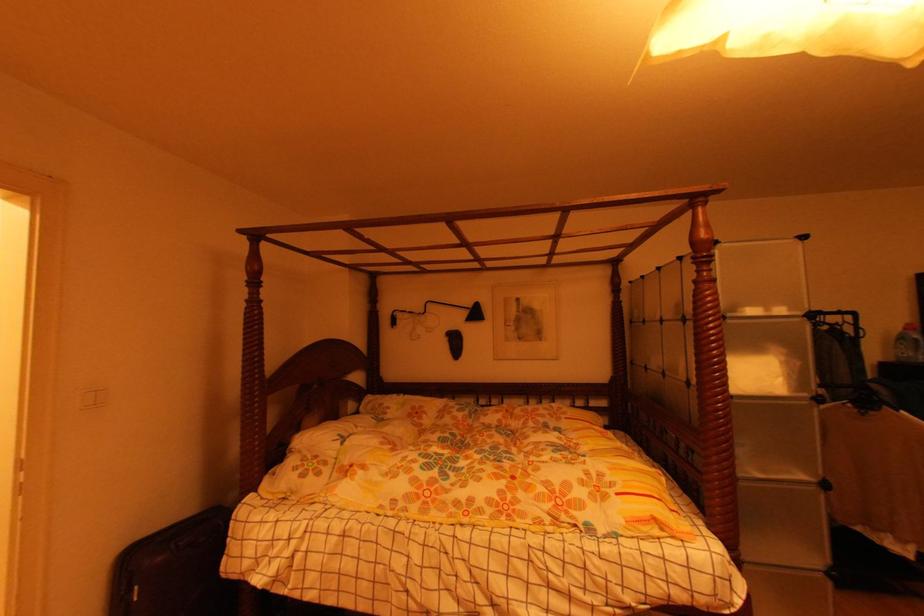
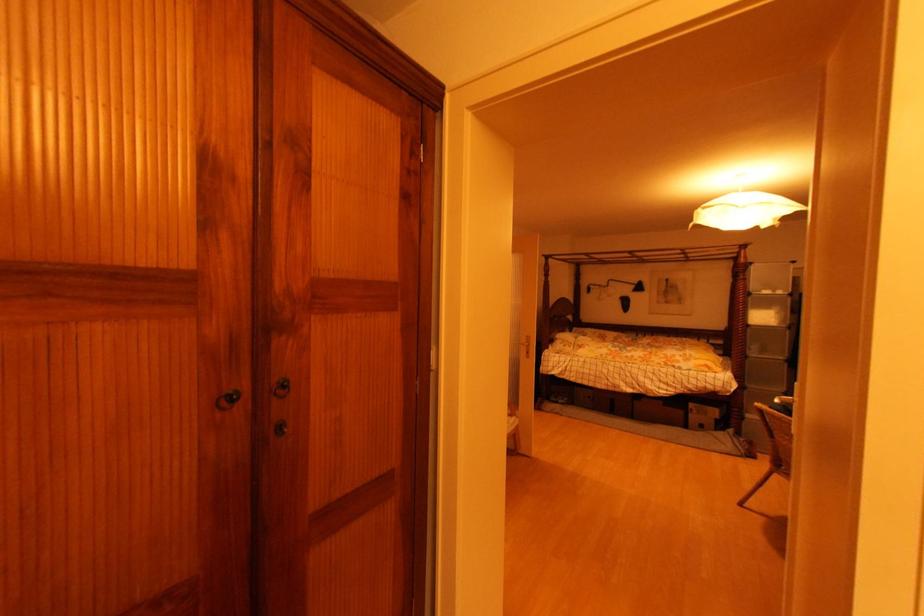
Where in the second image is the point corresponding to the point at 469,314 from the first image?

(638, 288)